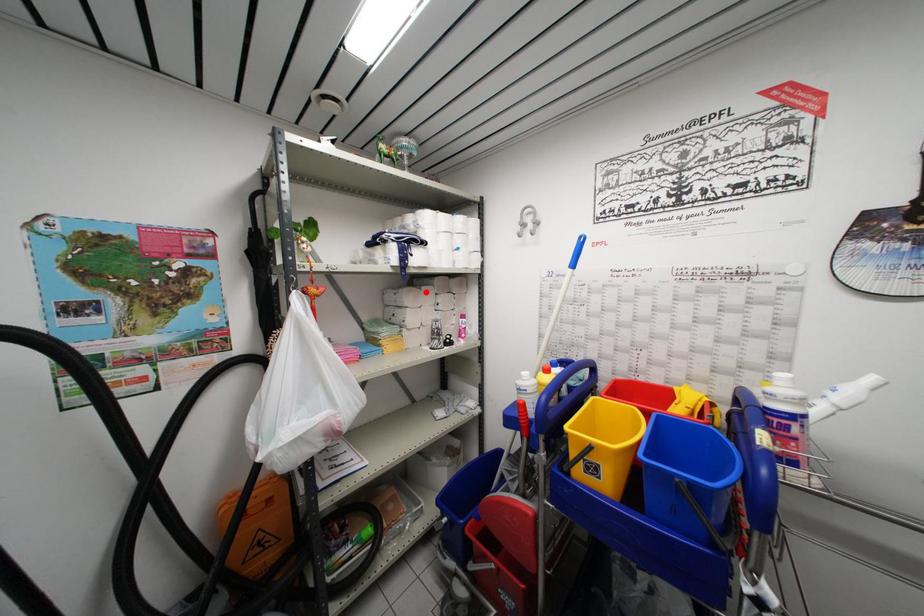
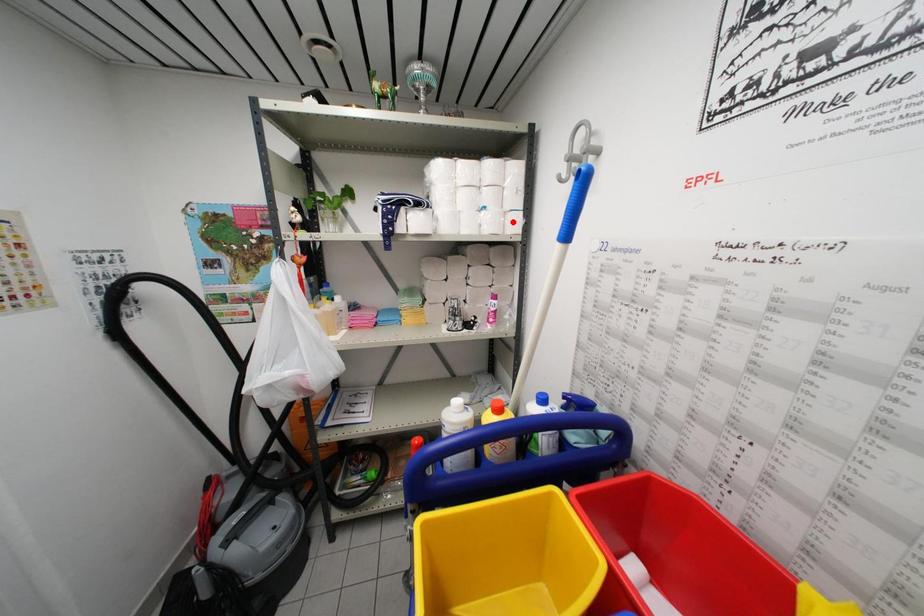
I am providing you with two images of the same scene from different viewpoints. A red point is marked on the first image and another point is marked on the second image. Are the points marked in image1 and image2 representing the same 3D position?

No